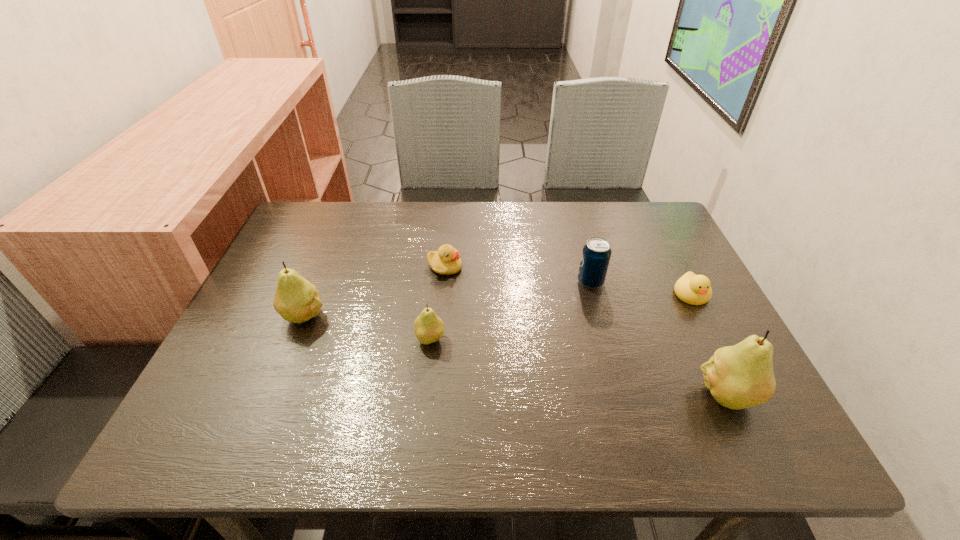
This screenshot has height=540, width=960. Find the location of `vacant space located on the back of the nearest pear`. vacant space located on the back of the nearest pear is located at coordinates (670, 275).

Image resolution: width=960 pixels, height=540 pixels. In order to click on free location located 0.140m on the face of the nearer duckling in this screenshot , I will do `click(722, 355)`.

You are a GUI agent. You are given a task and a screenshot of the screen. Output one action in this format:
    pyautogui.click(x=<x>, y=<y>)
    Task: Click on the free space located 0.340m on the front-facing side of the farther duckling
    The height and width of the screenshot is (540, 960).
    Given the screenshot: What is the action you would take?
    pyautogui.click(x=590, y=267)

I want to click on free space located on the back of the third object from right to left, so click(569, 206).

Find the location of a particular element. This screenshot has height=540, width=960. object that is at the near edge is located at coordinates (740, 376).

Identify the location of object at the left edge. The height and width of the screenshot is (540, 960). (297, 300).

Find the location of a particular element. pear situated at the right edge is located at coordinates (740, 376).

Image resolution: width=960 pixels, height=540 pixels. In order to click on duckling that is at the right edge in this screenshot , I will do `click(693, 289)`.

This screenshot has height=540, width=960. I want to click on object present at the near right corner, so click(x=740, y=376).

I want to click on free spot at the far edge of the desktop, so click(x=538, y=216).